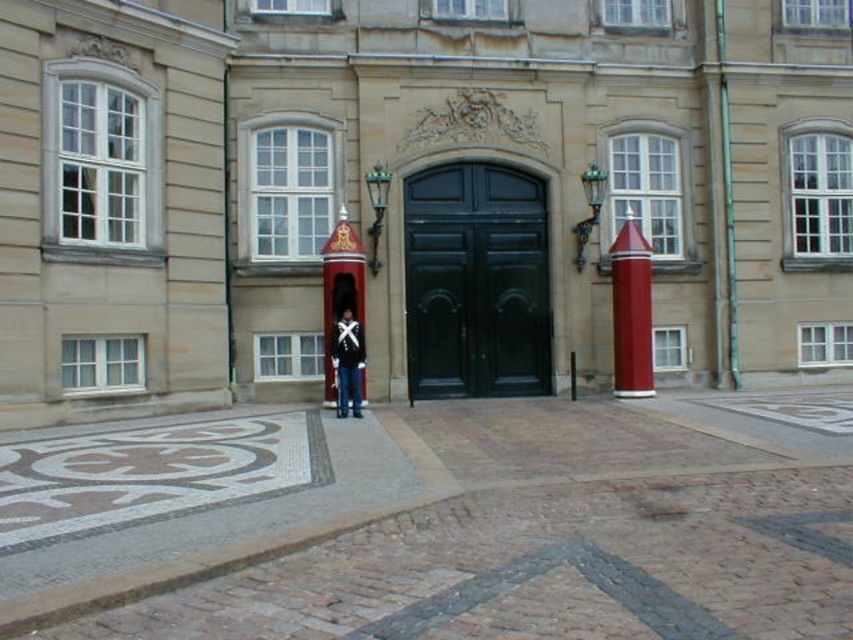
Question: Can you confirm if smooth red pillar at center right is positioned above uniformed man at center?

Choices:
 (A) no
 (B) yes

Answer: (B)

Question: Among these objects, which one is farthest from the camera?

Choices:
 (A) smooth stone palace at center
 (B) smooth red pillar at center right
 (C) uniformed man at center
 (D) green polished wood door at center

Answer: (D)

Question: Among these objects, which one is nearest to the camera?

Choices:
 (A) uniformed man at center
 (B) smooth stone palace at center
 (C) green polished wood door at center

Answer: (B)

Question: From the image, what is the correct spatial relationship of smooth stone palace at center in relation to uniformed man at center?

Choices:
 (A) right
 (B) left

Answer: (A)

Question: Which of these objects is positioned closest to the uniformed man at center?

Choices:
 (A) smooth stone palace at center
 (B) smooth red pillar at center right

Answer: (A)

Question: Does green polished wood door at center have a smaller size compared to smooth red pillar at center right?

Choices:
 (A) yes
 (B) no

Answer: (B)